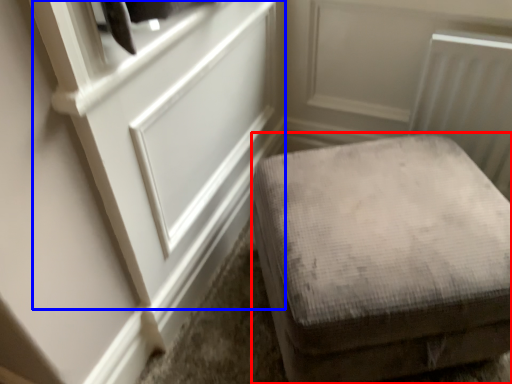
Question: Which object appears closest to the camera in this image, furniture (highlighted by a red box) or door (highlighted by a blue box)?

Choices:
 (A) furniture
 (B) door

Answer: (B)